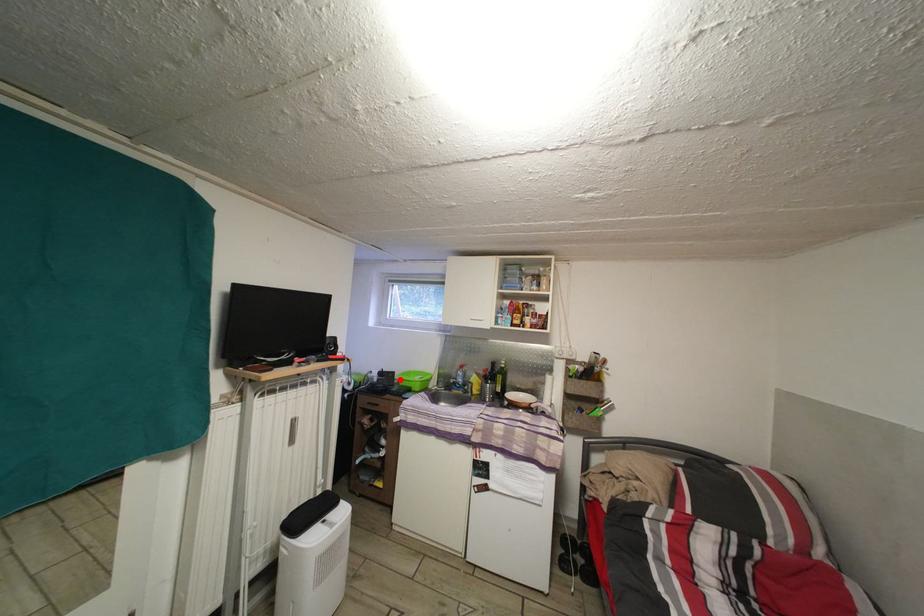
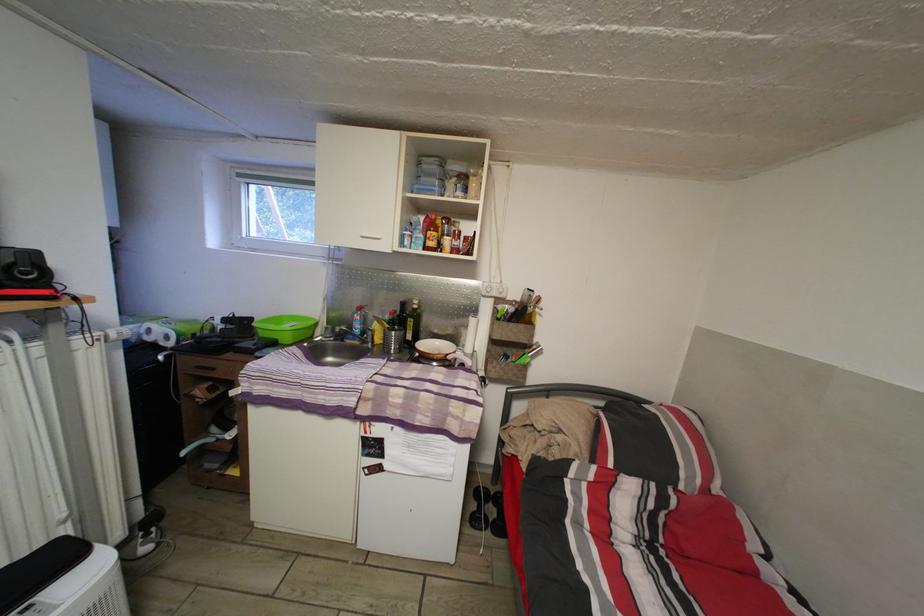
Find the pixel in the second image that matches the highlighted location in the first image.

(257, 326)